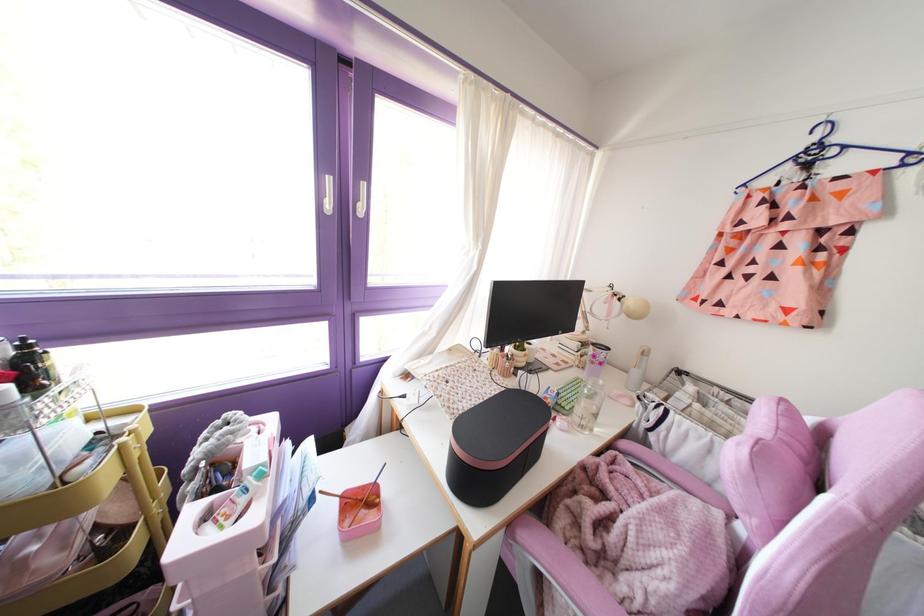
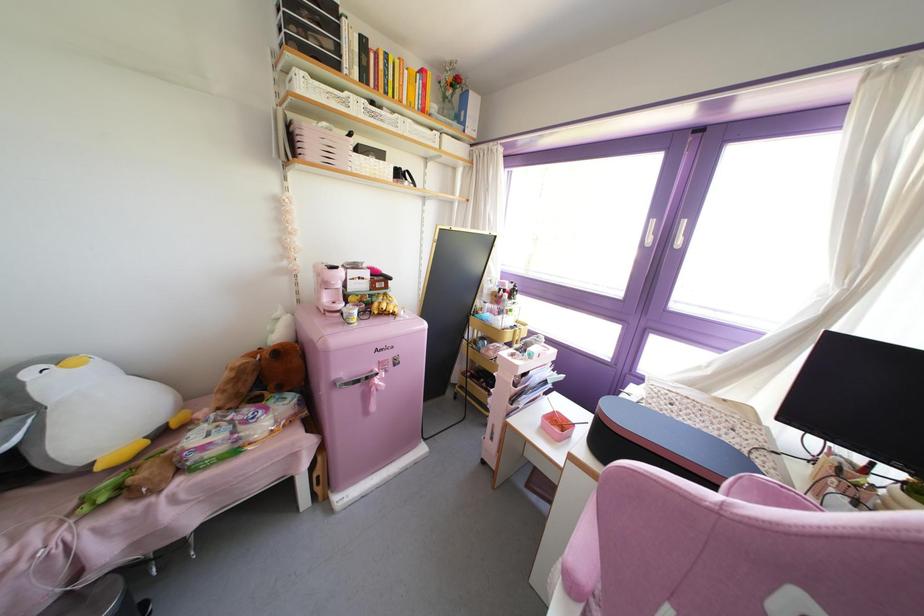
Locate, in the second image, the point that corresponds to [192,484] in the first image.

(516, 345)